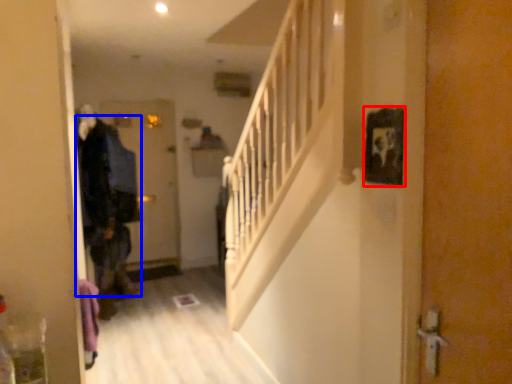
Question: Which point is further to the camera, picture frame (highlighted by a red box) or clothing (highlighted by a blue box)?

Choices:
 (A) picture frame
 (B) clothing

Answer: (B)